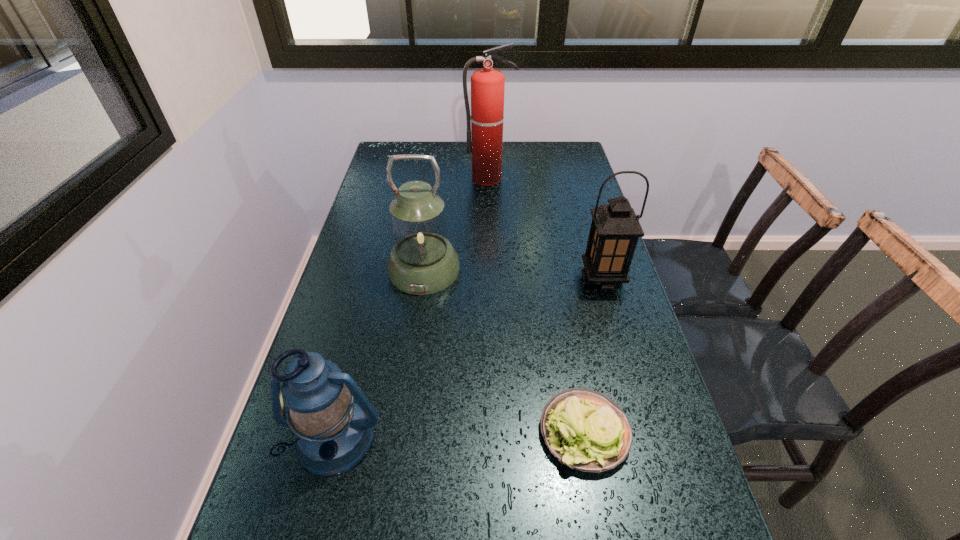
Where is `lantern that is at the right edge`? lantern that is at the right edge is located at coordinates (614, 232).

Image resolution: width=960 pixels, height=540 pixels. I want to click on lettuce that is at the right edge, so click(x=586, y=430).

Identify the location of vacant region at the left edge of the desktop. This screenshot has height=540, width=960. (406, 174).

In the image, there is a desktop. Where is `vacant area at the right edge`? Image resolution: width=960 pixels, height=540 pixels. vacant area at the right edge is located at coordinates (620, 295).

Image resolution: width=960 pixels, height=540 pixels. Find the location of `vacant space at the far right corner of the desktop`. vacant space at the far right corner of the desktop is located at coordinates [540, 152].

Locate an element on the screen. This screenshot has width=960, height=540. vacant area that lies between the shortest object and the second shortest object is located at coordinates (460, 435).

Locate an element on the screen. The image size is (960, 540). free area in between the nearest lantern and the shortest object is located at coordinates (460, 435).

Identify the location of free point between the rightmost lantern and the third object from left to right. (545, 228).

This screenshot has width=960, height=540. Find the location of `vacant area that lies between the nearest lantern and the lettuce`. vacant area that lies between the nearest lantern and the lettuce is located at coordinates coord(460,435).

Locate an element on the screen. object that is the second closest to the nearest lantern is located at coordinates (422, 261).